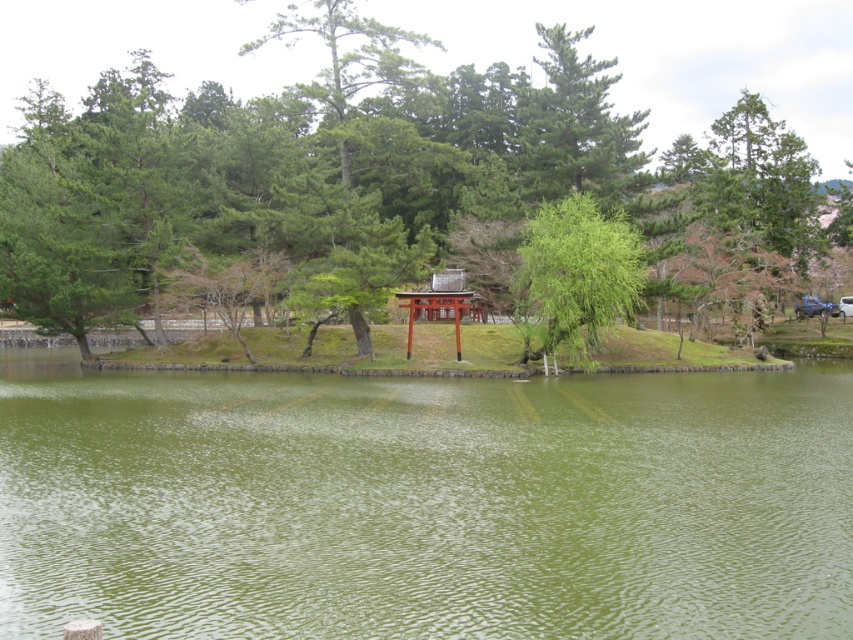
You are a hiker planning to cross from the green matte tree at center to the green leafy tree at center. Given that your average walking speed is 1.5 meters per second, how many seconds will it take you to walk directly between them?

The distance between the green matte tree at center and the green leafy tree at center is 60.30 meters. At a speed of 1.5 meters per second, the time required would be 60.30 divided by 1.5, which equals approximately 40.2 seconds.

You are standing at the edge of the water and want to place a small floating decoration exactly at the center of the green smooth water at center. According to the coordinates provided, where should you place it?

The green smooth water at center is located at coordinates point (424, 502), so you should place the decoration there.